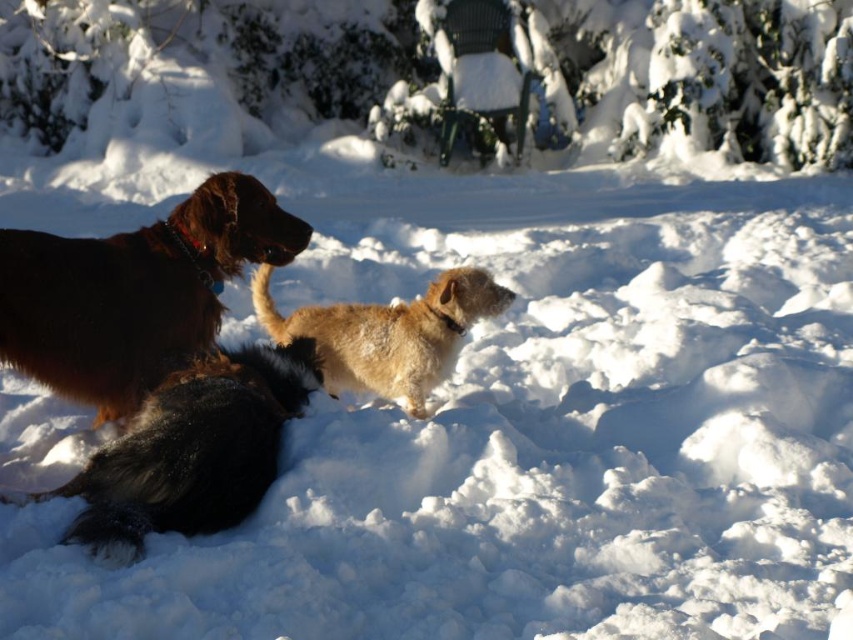
What is located at the coordinates point (x=134, y=292) in the image?

The shiny brown fur at left is located at point (x=134, y=292).

You are standing in the snowy landscape and want to approach the black fluffy dog at left. If you can walk 15 feet per minute, how many minutes will it take you to reach the dog?

The distance between you and the black fluffy dog at left is 14.59 feet. At a walking speed of 15 feet per minute, you would reach the dog in approximately 0.97 minutes, which is roughly 58 seconds.